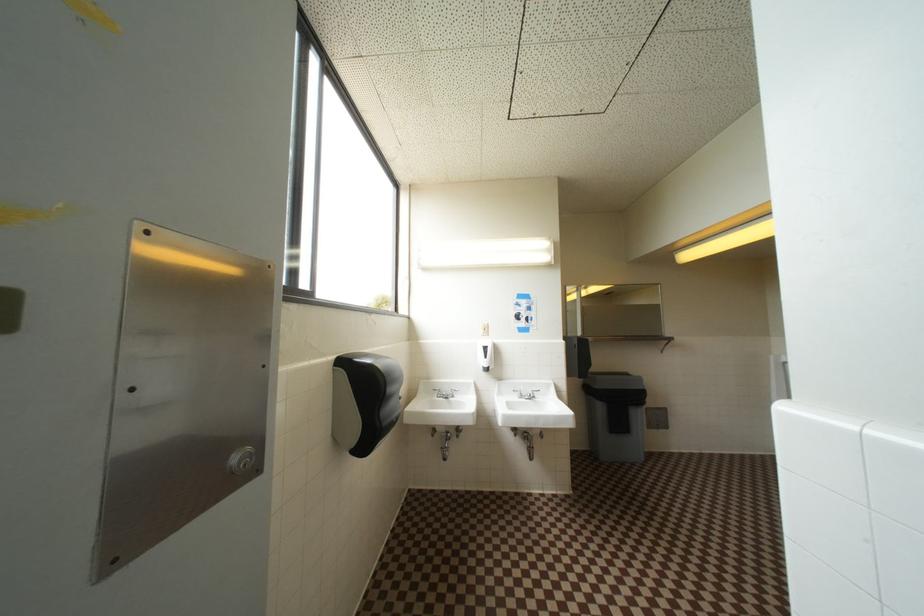
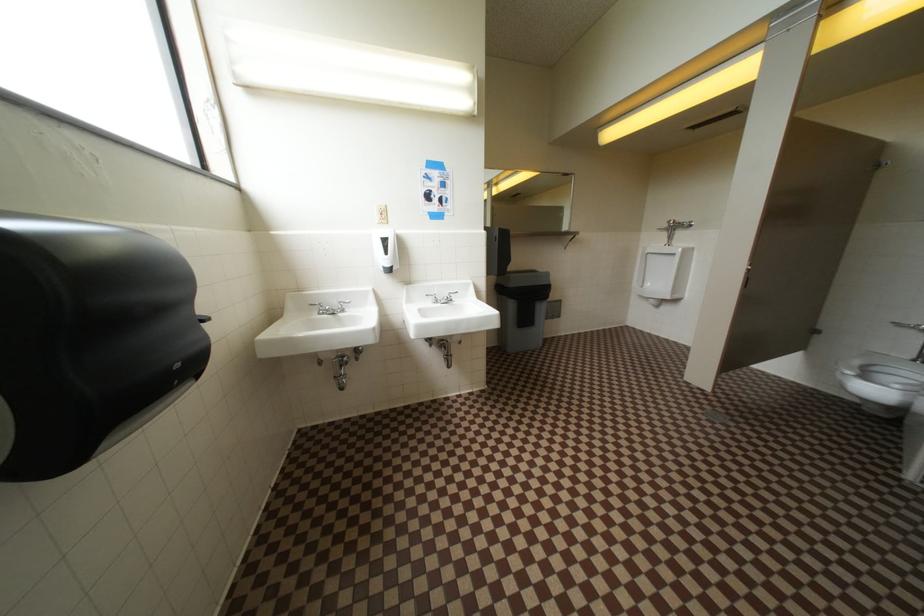
How did the camera likely rotate?

The camera's rotation is toward right-down.